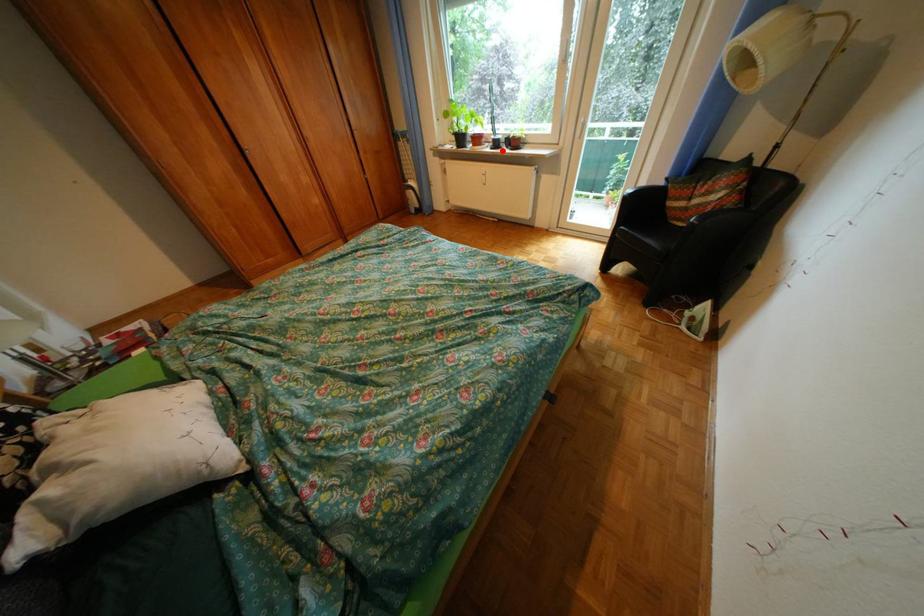
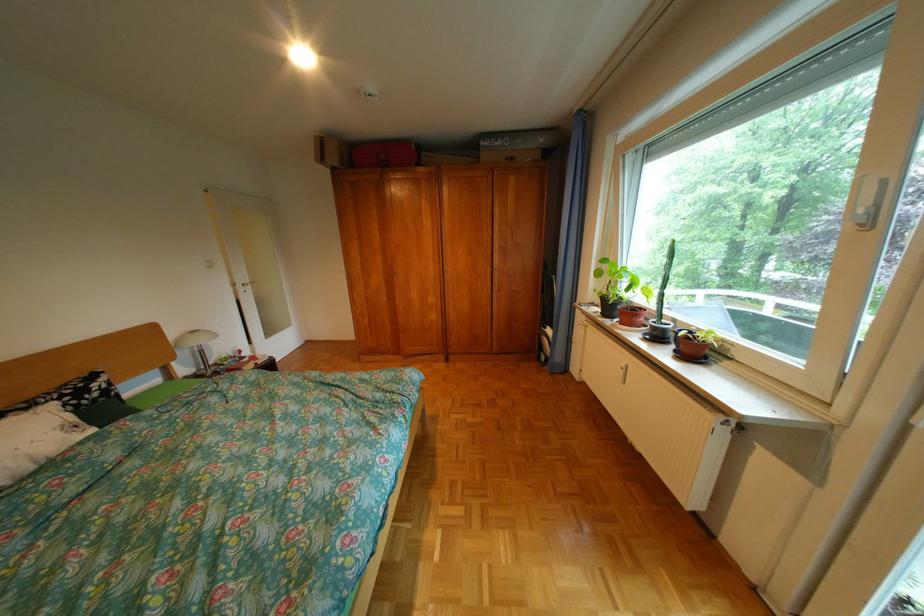
In the second image, find the point that corresponds to the highlighted location in the first image.

(650, 338)